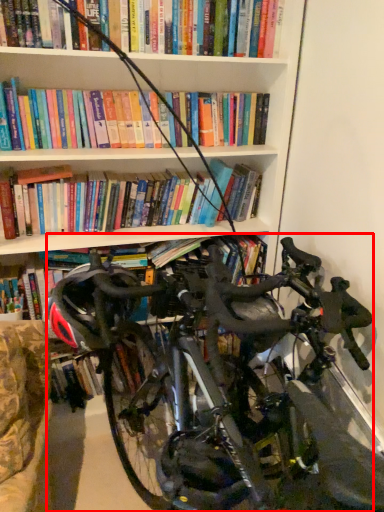
Question: Observing the image, what is the correct spatial positioning of bicycle (annotated by the red box) in reference to helmet?

Choices:
 (A) left
 (B) right

Answer: (B)